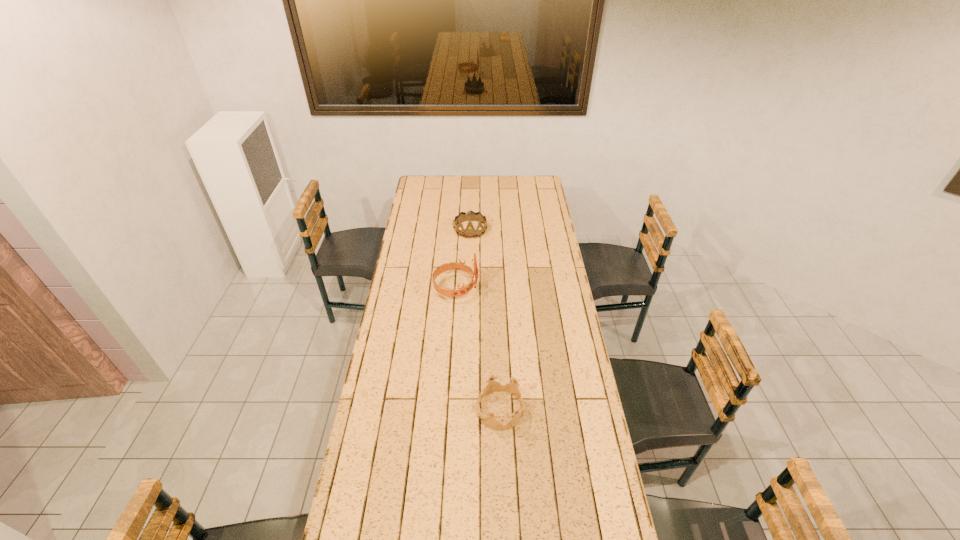
This screenshot has height=540, width=960. In order to click on the tallest tiara in this screenshot , I will do `click(462, 290)`.

Where is `the second farthest tiara`? This screenshot has width=960, height=540. the second farthest tiara is located at coordinates (462, 290).

Locate an element on the screen. The image size is (960, 540). the farthest object is located at coordinates (469, 232).

Find the location of a particular element. the farthest tiara is located at coordinates [x=469, y=232].

Where is `the shortest object`? This screenshot has height=540, width=960. the shortest object is located at coordinates (492, 386).

You are a GUI agent. You are given a task and a screenshot of the screen. Output one action in this format:
    pyautogui.click(x=<x>, y=<y>)
    Task: Click on the nearest tiara
    This screenshot has width=960, height=540.
    Given the screenshot: What is the action you would take?
    pyautogui.click(x=492, y=386)

What are the coordinates of `vacant space located 0.070m on the front-facing side of the second nearest object` in the screenshot? It's located at (494, 288).

Locate an element on the screen. This screenshot has height=540, width=960. vacant space located at the front of the second tallest tiara with jewels is located at coordinates (468, 291).

The width and height of the screenshot is (960, 540). I want to click on free location located on the front-facing side of the shortest tiara, so click(411, 410).

Locate an element on the screen. The height and width of the screenshot is (540, 960). vacant point located 0.070m on the front-facing side of the shortest tiara is located at coordinates (459, 410).